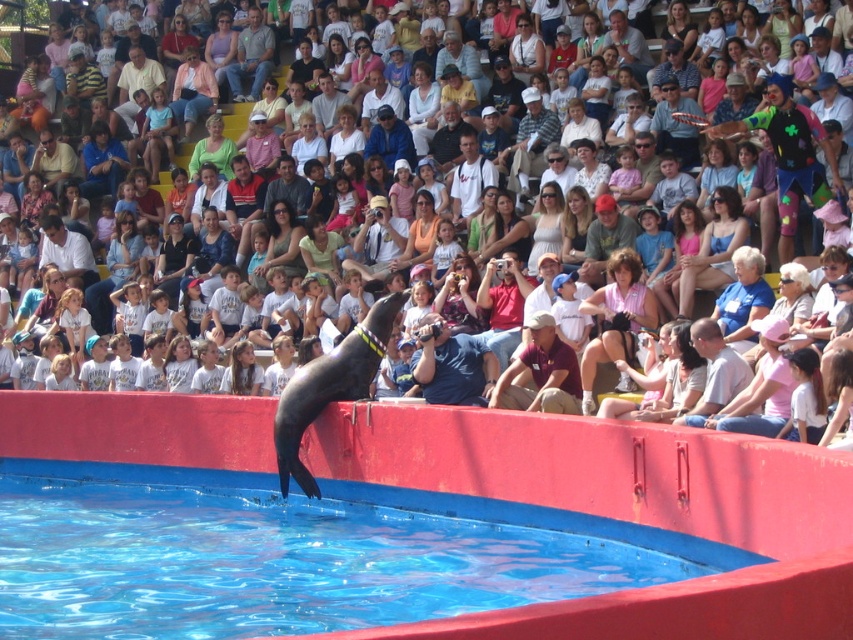
You are a marine trainer preparing to throw a fish into the blue smooth water at center where the matte black seal at center is swimming. Which object should you aim for to ensure the seal gets the fish?

You should aim for the blue smooth water at center since the matte black seal at center is swimming in it. The blue smooth water at center is smaller than the seal, but it is the location where the seal is present.

You are a photographer positioned at the back of the audience. You want to take a photo of the seal jumping out of the blue smooth water at center. However, there is a blue shirt at center blocking your view. Can you still capture the seal in your photo?

The blue smooth water at center is in front of the blue shirt at center, so the blue shirt at center is behind the water. Therefore, you can still capture the seal jumping out of the blue smooth water at center in your photo because the blue shirt at center does not block the view.